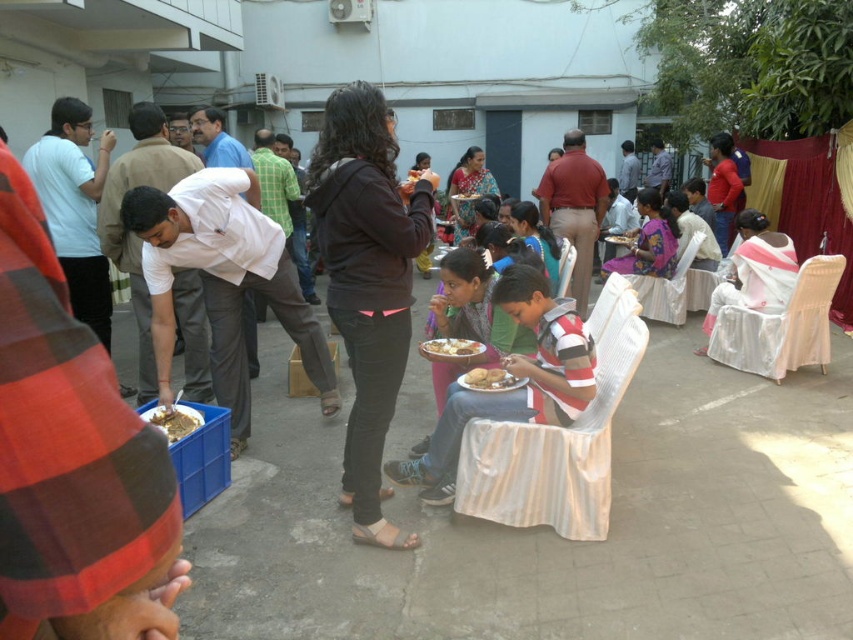
You are a guest at this event and need to place your dark brown leather jacket at center onto a surface. Can you put it on the shiny metallic tray at lower left?

The dark brown leather jacket at center is located above the shiny metallic tray at lower left, so yes, you can place it there since it is positioned directly above the tray.

You are a photographer at the event and need to capture a closeup of the dark brown leather jacket at center without the shiny metallic tray at lower left appearing in the frame. Is the jacket wide enough to block the tray from view?

The dark brown leather jacket at center might be wider than shiny metallic tray at lower left, so there is a possibility that the jacket could block the tray from view if positioned correctly.